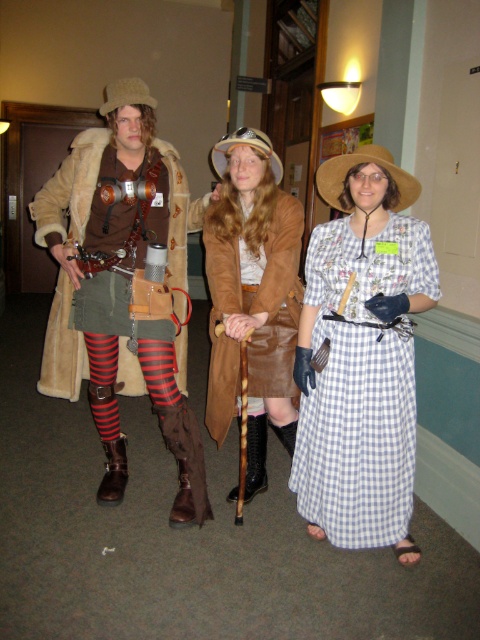
You are standing in a hallway with three costumed individuals. There is a point marked at coordinates (47, 387). If you want to move closer to this point, which direction should you move?

The point at (47, 387) is 8.46 feet away from the viewer. To move closer to it, you should move forward towards the point.

You are standing in the hallway and want to determine which of the two points, point (79,227) or point (244,218), is closer to you. Based on the scene description, which point is nearer?

Point (79,227) is further to the camera than point (244,218). Therefore, point (244,218) is closer to you.